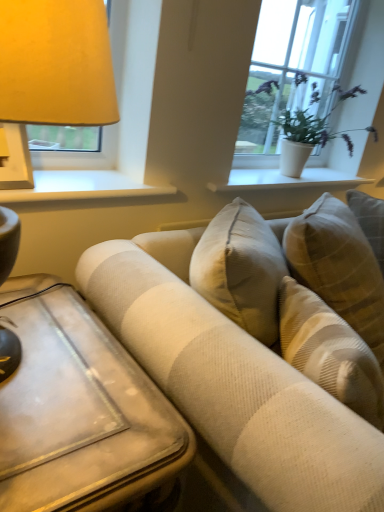
Image resolution: width=384 pixels, height=512 pixels. Find the location of `free location above white painted wood at upper left, the 2th window sill positioned from the back (from a real-world perspective)`. free location above white painted wood at upper left, the 2th window sill positioned from the back (from a real-world perspective) is located at coordinates (80, 177).